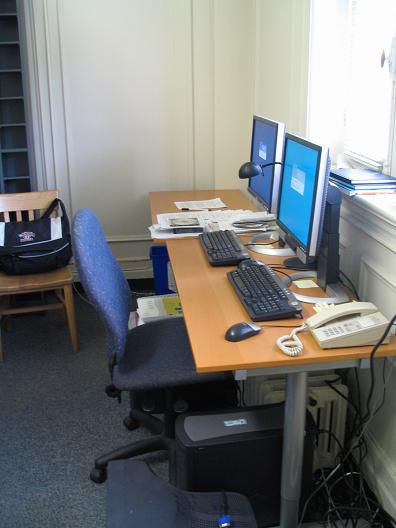
You are a GUI agent. You are given a task and a screenshot of the screen. Output one action in this format:
    pyautogui.click(x=<x>, y=<y>)
    Task: Click on the phone
    
    Given the screenshot: What is the action you would take?
    pyautogui.click(x=343, y=319)